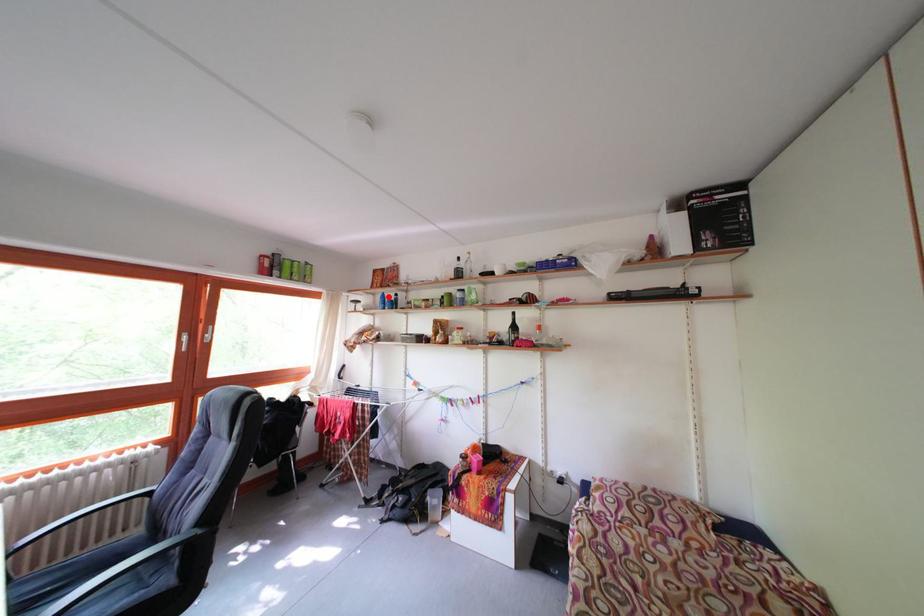
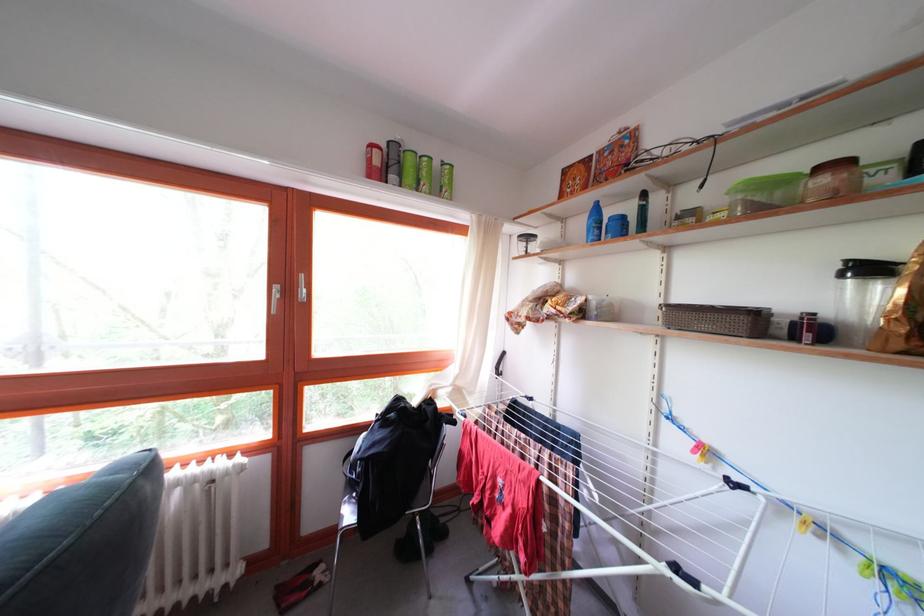
In the second image, find the point that corresponds to the highlighted location in the first image.

(598, 204)